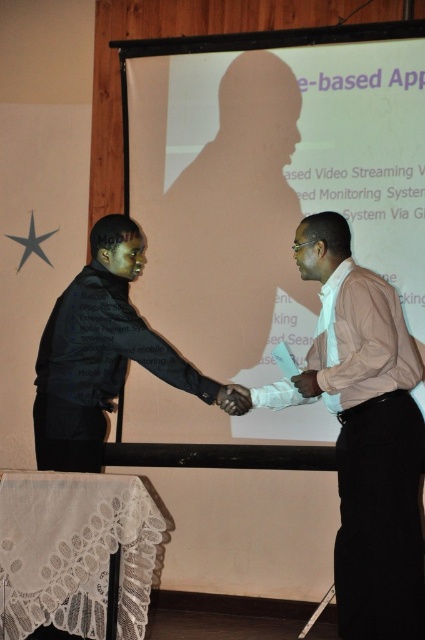
You are an event photographer trying to capture the handshake between the black matte suit at center and the matte black hand at center. Which object should you focus on if you want to ensure the wider subject is in sharp focus?

The black matte suit at center is wider than the matte black hand at center, so you should focus on the black matte suit at center to ensure the wider subject is in sharp focus.

You are a photographer at the event and want to capture a clear photo of the black matte suit at center without any obstruction. Based on their positions, can you adjust your angle to ensure the matte black hand at center isn not blocking the view?

The black matte suit at center is in front of the matte black hand at center, so adjusting the angle to focus on the front of the black matte suit at center would allow you to capture it without the hand blocking the view.

You are an event planner trying to set up a camera to capture the presenter in the black matte suit at center. The camera has a fixed focus at point 0.5, 0.2. Will the camera be able to focus on the presenter?

The position of black matte suit at center is at point (99, 352), which is slightly off from the camera focus at (85, 320). The camera may not focus perfectly on the presenter.